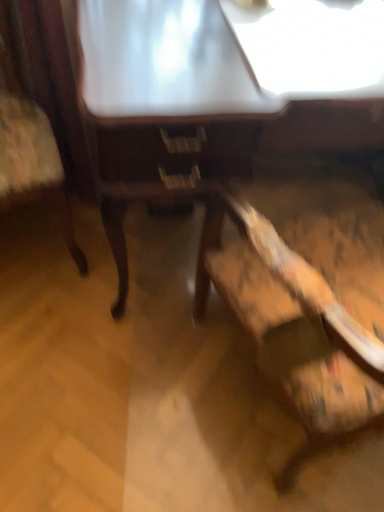
Where is `vacant space underneath wooden chair at lower right, which is the 1th chair from right to left (from a real-world perspective)`? vacant space underneath wooden chair at lower right, which is the 1th chair from right to left (from a real-world perspective) is located at coordinates (275, 407).